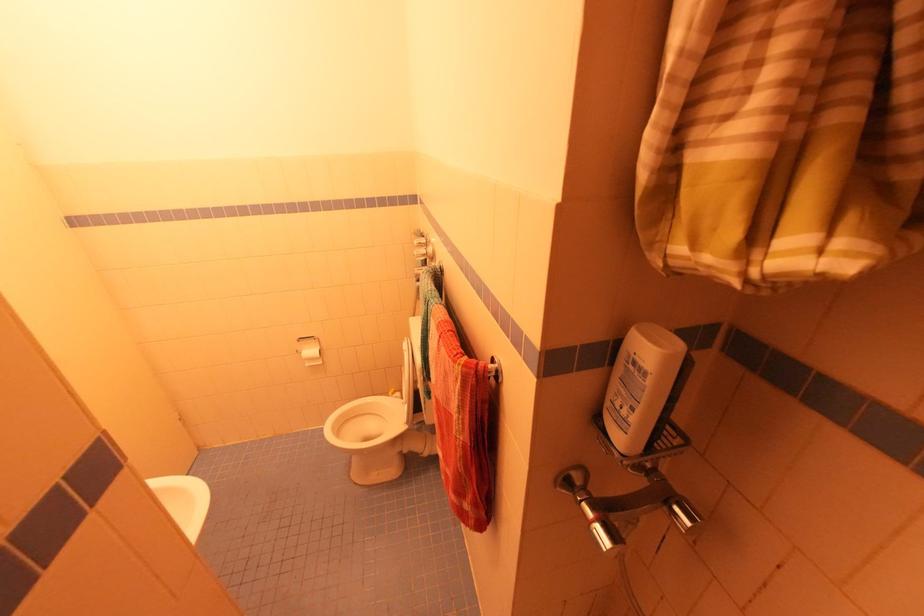
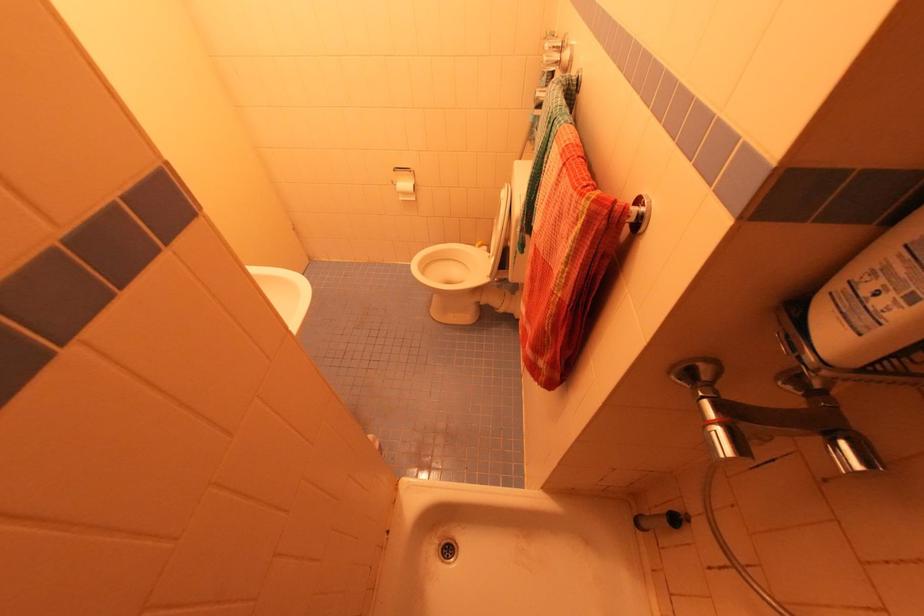
In the second image, find the point that corresponds to [596,532] in the first image.

(715, 434)